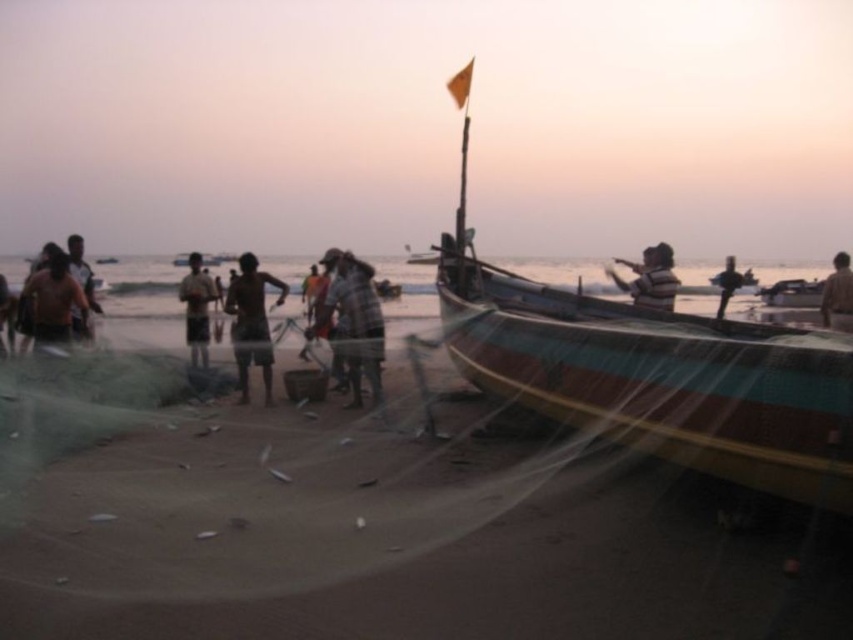
You are standing on the beach and see the wooden boat at center and the brown fabric shirt at lower right. Which object is closer to you?

The brown fabric shirt at lower right is closer to you because the wooden boat at center is positioned over it, indicating it is farther away.